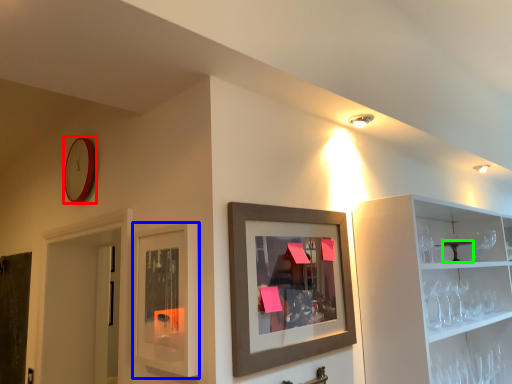
Question: Based on their relative distances, which object is farther from clock (highlighted by a red box)? Choose from cabinet (highlighted by a blue box) and table (highlighted by a green box).

Choices:
 (A) cabinet
 (B) table

Answer: (B)